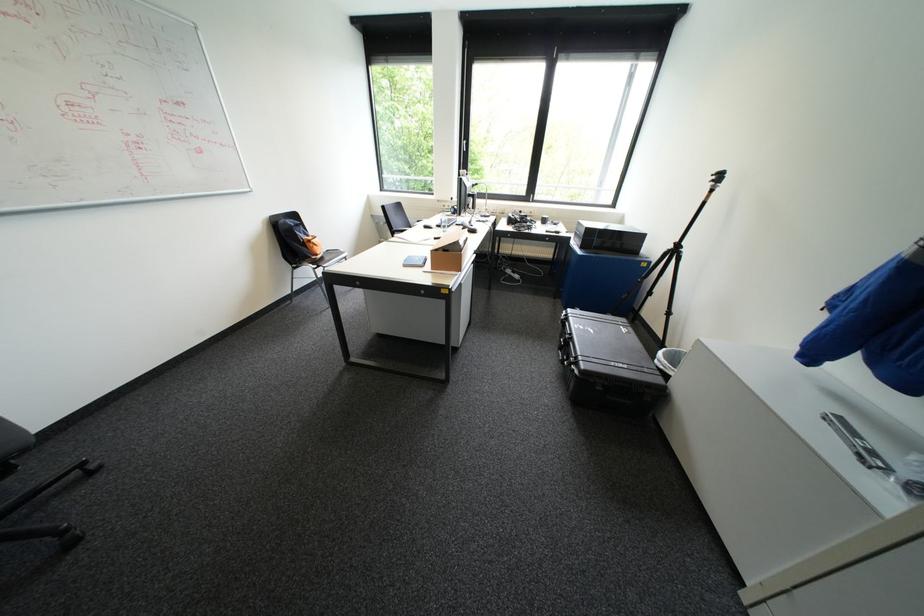
The image size is (924, 616). What do you see at coordinates (576, 373) in the screenshot?
I see `the black case latch` at bounding box center [576, 373].